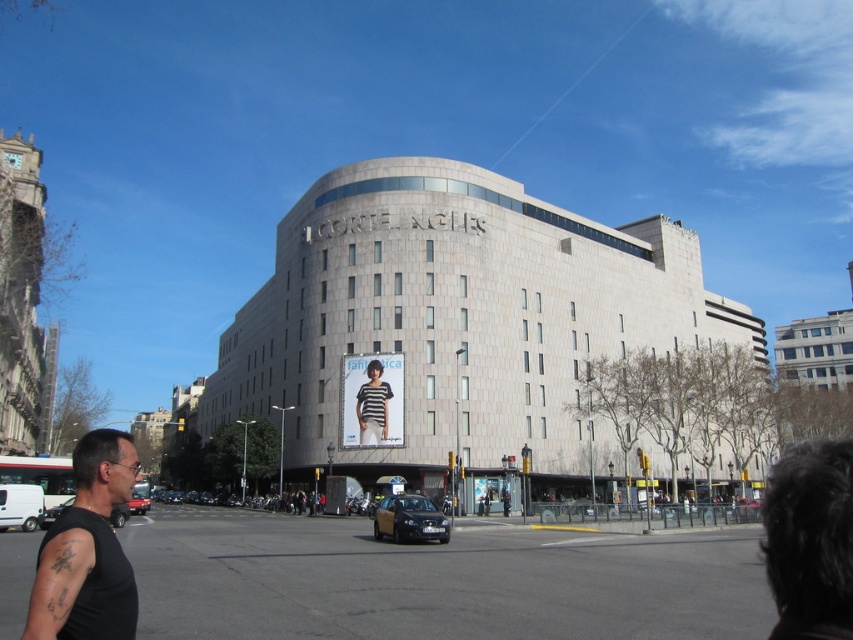
Question: In this image, where is black matte tank top at lower left located relative to striped fabric shirt at center?

Choices:
 (A) below
 (B) above

Answer: (B)

Question: Which object appears closest to the camera in this image?

Choices:
 (A) striped fabric shirt at center
 (B) black matte tank top at lower left

Answer: (B)

Question: Is black matte tank top at lower left to the left of striped fabric shirt at center from the viewer's perspective?

Choices:
 (A) yes
 (B) no

Answer: (A)

Question: Which object is closer to the camera taking this photo?

Choices:
 (A) black matte tank top at lower left
 (B) striped fabric shirt at center

Answer: (A)

Question: Can you confirm if black matte tank top at lower left is bigger than striped fabric shirt at center?

Choices:
 (A) yes
 (B) no

Answer: (A)

Question: Among these objects, which one is nearest to the camera?

Choices:
 (A) black matte tank top at lower left
 (B) striped fabric shirt at center

Answer: (A)